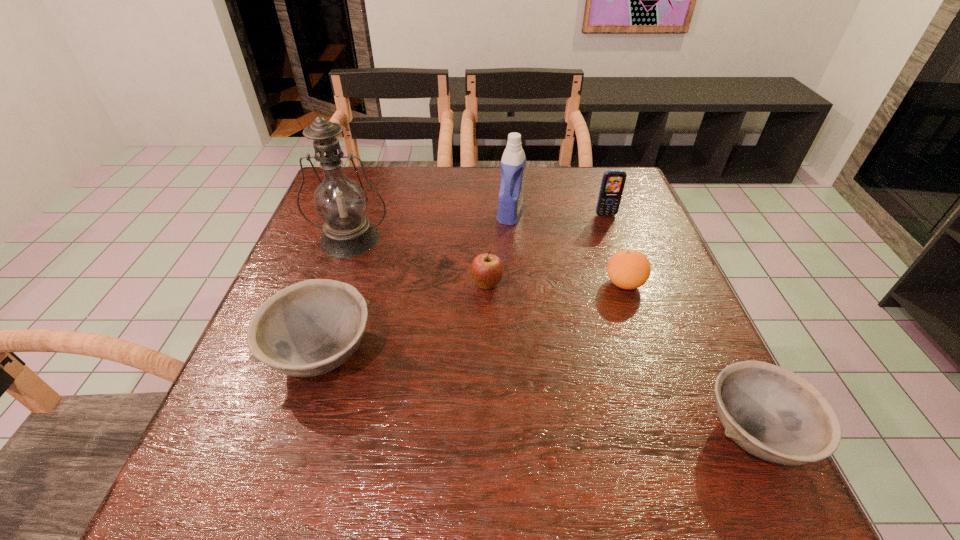
I want to click on empty space between the apple and the detergent, so pos(498,249).

Identify the location of free space between the orange and the taller bowl. The height and width of the screenshot is (540, 960). (473, 319).

You are a GUI agent. You are given a task and a screenshot of the screen. Output one action in this format:
    pyautogui.click(x=<x>, y=<y>)
    Task: Click on the free space between the apple and the left bowl
    Image resolution: width=960 pixels, height=540 pixels.
    Given the screenshot: What is the action you would take?
    pyautogui.click(x=404, y=320)

Identify the location of empty location between the apple and the left bowl. (404, 320).

Image resolution: width=960 pixels, height=540 pixels. Identify the location of unoccupied position between the fifth shortest object and the right bowl. (680, 324).

Where is `empty location between the sixth shortest object and the apple`? The height and width of the screenshot is (540, 960). empty location between the sixth shortest object and the apple is located at coordinates (498, 249).

Point out which object is positioned as the second nearest to the apple. Please provide its 2D coordinates. Your answer should be formatted as a tuple, i.e. [(x, y)], where the tuple contains the x and y coordinates of a point satisfying the conditions above.

[(310, 328)]

This screenshot has height=540, width=960. In order to click on object that is the fifth closest to the left bowl in this screenshot , I will do `click(772, 413)`.

Find the location of a particular element. Image resolution: width=960 pixels, height=540 pixels. vacant space that satisfies the following two spatial constraints: 1. on the front side of the sixth shortest object; 2. on the left side of the shorter bowl is located at coordinates (529, 433).

At what (x,y) coordinates should I click in order to perform the action: click on free space that satisfies the following two spatial constraints: 1. on the back side of the apple; 2. on the left side of the taller bowl. Please return your answer as a coordinate pair (x, y). The width and height of the screenshot is (960, 540). Looking at the image, I should click on (345, 285).